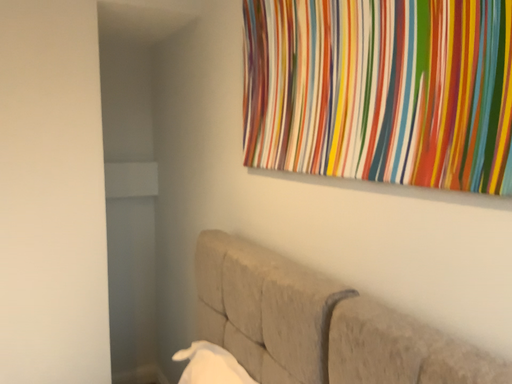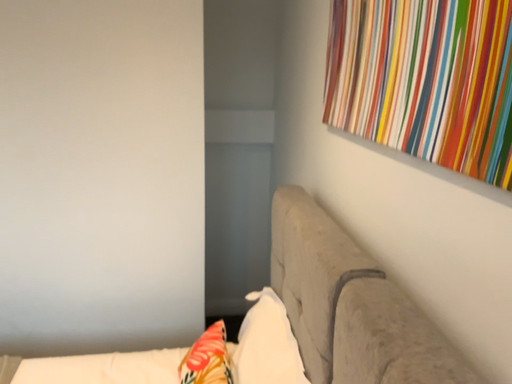
Question: Which way did the camera rotate in the video?

Choices:
 (A) rotated right
 (B) rotated left

Answer: (B)